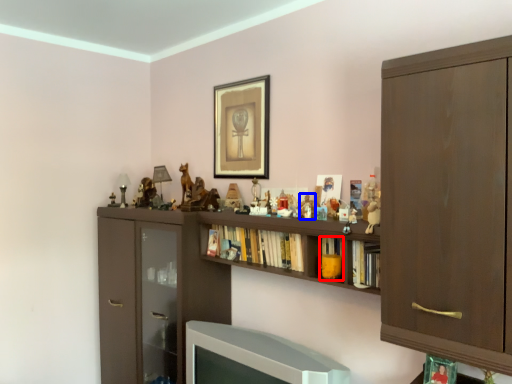
Question: Which object is further to the camera taking this photo, book (highlighted by a red box) or toy (highlighted by a blue box)?

Choices:
 (A) book
 (B) toy

Answer: (B)